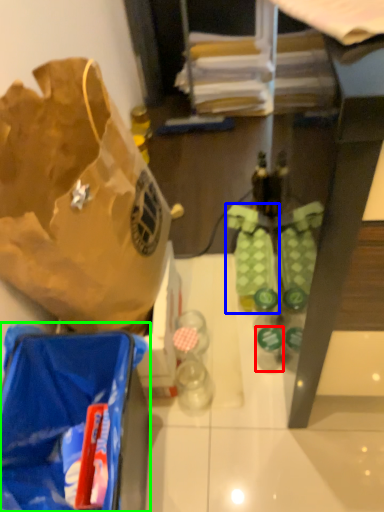
Question: Which is farther away from bottle (highlighted by a red box)? footwear (highlighted by a blue box) or luggage and bags (highlighted by a green box)?

Choices:
 (A) footwear
 (B) luggage and bags

Answer: (B)